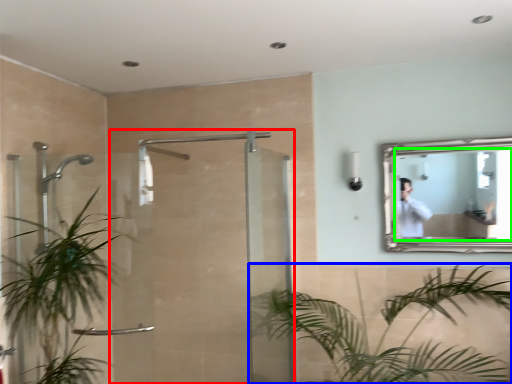
Question: Which object is positioned farthest from screen door (highlighted by a red box)? Select from houseplant (highlighted by a blue box) and mirror (highlighted by a green box).

Choices:
 (A) houseplant
 (B) mirror

Answer: (B)